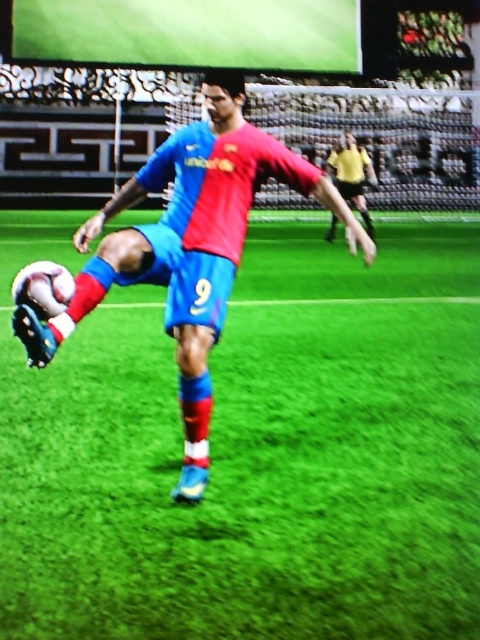
Can you confirm if green artificial turf at center is bigger than shiny blue shorts at center?

Yes, green artificial turf at center is bigger than shiny blue shorts at center.

Based on the photo, which is below, green artificial turf at center or shiny blue shorts at center?

green artificial turf at center is below.

Identify the location of green artificial turf at center. (252, 449).